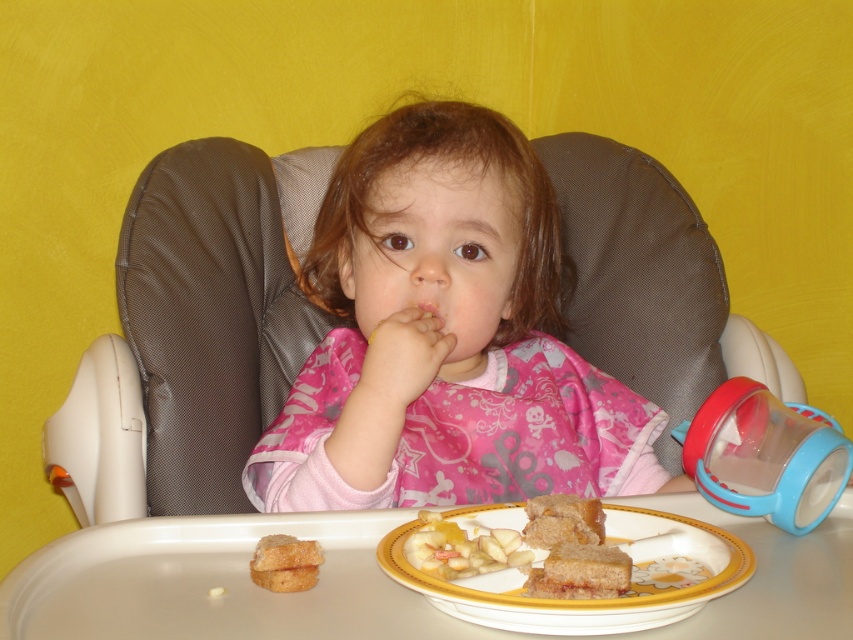
Is smooth white bread at plate center closer to the viewer compared to golden crispy bread at plate center?

Yes.

Where is `smooth white bread at plate center`? The height and width of the screenshot is (640, 853). smooth white bread at plate center is located at coordinates (462, 548).

Between point (717, 547) and point (294, 582), which one is positioned in front?

Point (294, 582) is in front.

Can you confirm if yellow ceramic plate with food at lower center is taller than golden crispy bread at plate center?

Indeed, yellow ceramic plate with food at lower center has a greater height compared to golden crispy bread at plate center.

The height and width of the screenshot is (640, 853). What do you see at coordinates (585, 600) in the screenshot?
I see `yellow ceramic plate with food at lower center` at bounding box center [585, 600].

Image resolution: width=853 pixels, height=640 pixels. In order to click on yellow ceramic plate with food at lower center in this screenshot , I will do `click(585, 600)`.

Can you confirm if pink fabric bib at center is positioned above golden crispy bread at plate center?

Correct, pink fabric bib at center is located above golden crispy bread at plate center.

Looking at this image, who is positioned more to the left, pink fabric bib at center or golden crispy bread at plate center?

From the viewer's perspective, golden crispy bread at plate center appears more on the left side.

Is point (325, 214) less distant than point (292, 582)?

No, it is behind (292, 582).

At what (x,y) coordinates should I click in order to perform the action: click on pink fabric bib at center. Please return your answer as a coordinate pair (x, y). Looking at the image, I should click on (445, 337).